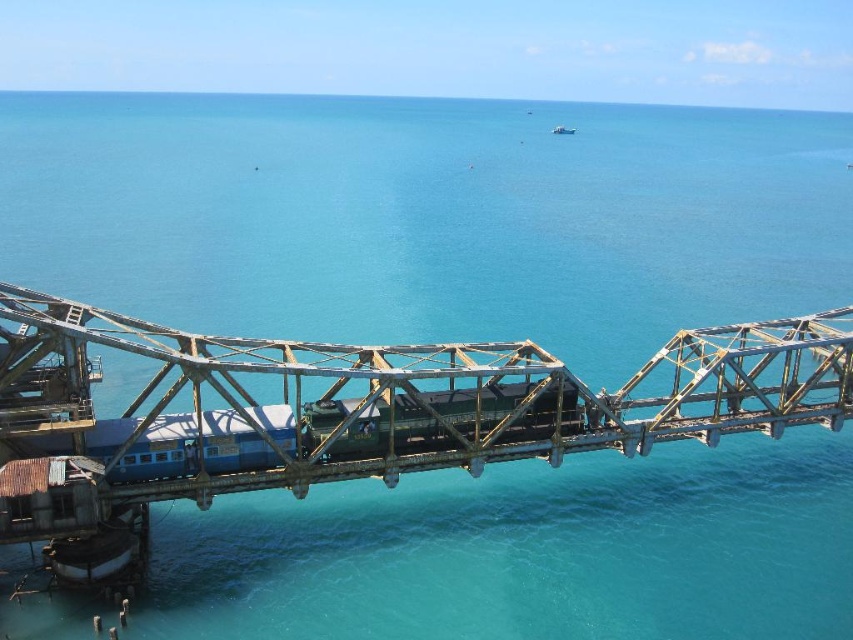
Question: Can you confirm if rusty metal bridge at center is positioned to the left of blue painted steel passenger train at center?

Choices:
 (A) no
 (B) yes

Answer: (A)

Question: Can you confirm if rusty metal bridge at center is positioned above blue painted steel passenger train at center?

Choices:
 (A) no
 (B) yes

Answer: (B)

Question: Is rusty metal bridge at center below blue painted steel passenger train at center?

Choices:
 (A) yes
 (B) no

Answer: (B)

Question: Which of the following is the farthest from the observer?

Choices:
 (A) rusty metal bridge at center
 (B) blue painted steel passenger train at center

Answer: (B)